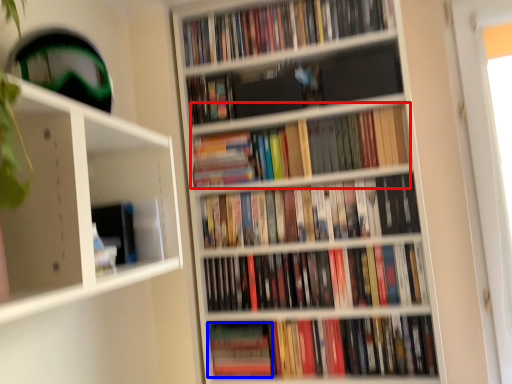
Question: Among these objects, which one is nearest to the camera, book (highlighted by a red box) or paperback book (highlighted by a blue box)?

Choices:
 (A) book
 (B) paperback book

Answer: (A)